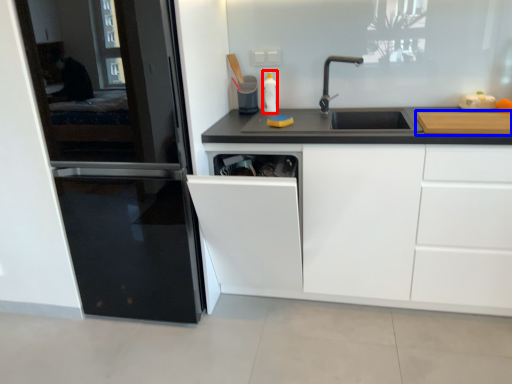
Question: Which object appears farthest to the camera in this image, bottle (highlighted by a red box) or cutting board (highlighted by a blue box)?

Choices:
 (A) bottle
 (B) cutting board

Answer: (A)